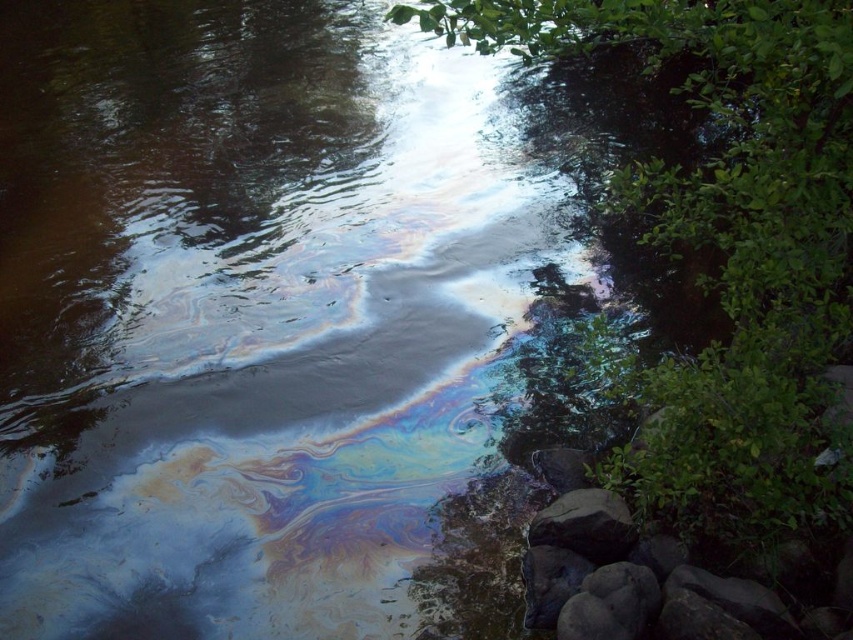
Which is below, green leafy tree at upper right or smooth gray rock at lower right?

smooth gray rock at lower right

Who is more distant from viewer, (843, 64) or (621, 500)?

The point (621, 500) is behind.

Who is more distant from viewer, (846, 161) or (560, 502)?

Positioned behind is point (560, 502).

At what (x,y) coordinates should I click in order to perform the action: click on green leafy tree at upper right. Please return your answer as a coordinate pair (x, y). The width and height of the screenshot is (853, 640). Looking at the image, I should click on click(x=727, y=248).